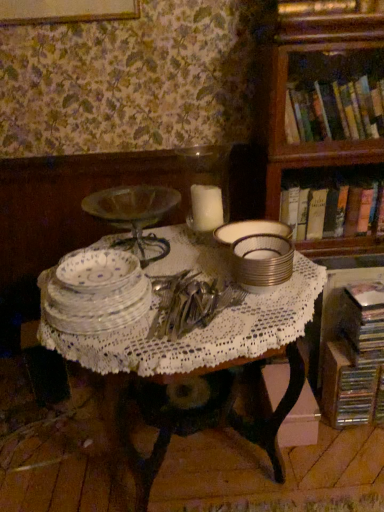
This screenshot has height=512, width=384. Find the location of `vacant region above hardcover book at right, the 2th book positioned from the bottom (from a real-world perspective)`. vacant region above hardcover book at right, the 2th book positioned from the bottom (from a real-world perspective) is located at coordinates (339, 176).